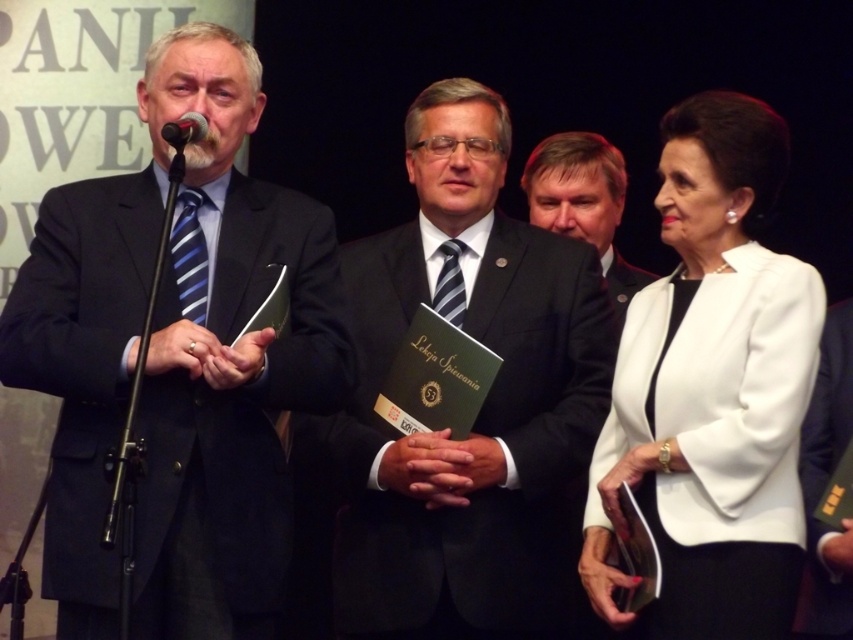
You are standing at the center of the stage and want to move towards the point that is closer to you. Which point should you move towards, point (688, 332) or point (614, 156)?

You should move towards point (688, 332) because it is closer to the viewer than point (614, 156).

You are an event organizer and need to arrange the seating for the next segment of the event. The seating arrangement requires that the person in the white matte blazer at center must sit in a seat that is directly behind the person in the dark suit at center. Is this possible based on their current positions?

The white matte blazer at center is positioned under dark suit at center, which means the person in the white matte blazer is already behind the person in the dark suit at center. Therefore, the seating arrangement requirement can be fulfilled as their current positions already satisfy the condition of the white matte blazer being behind the dark suit.

You are an event photographer positioned at the back of the stage. You need to capture a clear photo of both the matte black suit at left and the white matte blazer at center. Which person should you focus on first to ensure both are in focus?

You should focus on the matte black suit at left first because it is closer to you than the white matte blazer at center, ensuring both will be in focus when starting with the closer subject.